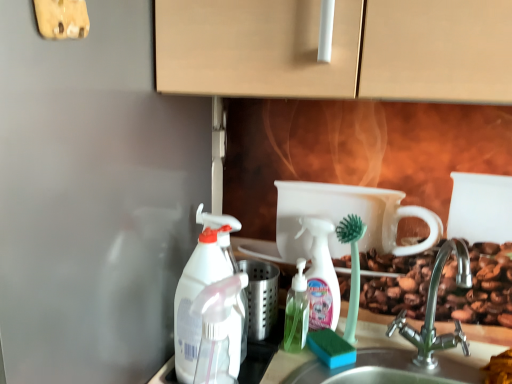
The height and width of the screenshot is (384, 512). What do you see at coordinates (321, 276) in the screenshot?
I see `translucent plastic spray bottle at center, the 1th cleaning product positioned from the right` at bounding box center [321, 276].

In order to face transparent plastic spray bottle at left, acting as the 3th cleaning product starting from the back, should I rotate leftwards or rightwards?

Rotate left and turn 4.954 degrees.

Identify the location of translucent plastic spray bottle at center, which appears as the third cleaning product when viewed from the front. The width and height of the screenshot is (512, 384). (321, 276).

Does satin nickel faucet at lower right turn towards green translucent soap dispenser at center?

No, satin nickel faucet at lower right is not oriented towards green translucent soap dispenser at center.

Between satin nickel faucet at lower right and green translucent soap dispenser at center, which one is positioned behind?

green translucent soap dispenser at center.

The image size is (512, 384). I want to click on bottle located below the satin nickel faucet at lower right (from the image's perspective), so click(x=297, y=312).

Which object is positioned more to the left, satin nickel faucet at lower right or green translucent soap dispenser at center?

From the viewer's perspective, green translucent soap dispenser at center appears more on the left side.

From the image's perspective, is green translucent soap dispenser at center positioned above or below white plastic spray bottle at left, marked as the third cleaning product in a right-to-left arrangement?

green translucent soap dispenser at center is below white plastic spray bottle at left, marked as the third cleaning product in a right-to-left arrangement.

Considering the relative positions of green translucent soap dispenser at center and white plastic spray bottle at left, the 2th cleaning product viewed from the back, in the image provided, is green translucent soap dispenser at center to the left of white plastic spray bottle at left, the 2th cleaning product viewed from the back, from the viewer's perspective?

In fact, green translucent soap dispenser at center is to the right of white plastic spray bottle at left, the 2th cleaning product viewed from the back.

Could you tell me if green translucent soap dispenser at center is facing white plastic spray bottle at left, marked as the third cleaning product in a right-to-left arrangement?

No, green translucent soap dispenser at center is not oriented towards white plastic spray bottle at left, marked as the third cleaning product in a right-to-left arrangement.

Is point (217, 348) closer to viewer compared to point (333, 298)?

Yes, it is in front of point (333, 298).

Which object is closer to the camera taking this photo, transparent plastic spray bottle at left, which appears as the second cleaning product when viewed from the right, or translucent plastic spray bottle at center, which appears as the third cleaning product when viewed from the front?

transparent plastic spray bottle at left, which appears as the second cleaning product when viewed from the right, is closer to the camera.

Which of these two, transparent plastic spray bottle at left, marked as the second cleaning product in a left-to-right arrangement, or translucent plastic spray bottle at center, which appears as the third cleaning product when viewed from the front, is smaller?

With smaller size is translucent plastic spray bottle at center, which appears as the third cleaning product when viewed from the front.

Is satin nickel faucet at lower right at the back of transparent plastic spray bottle at left, marked as the second cleaning product in a left-to-right arrangement?

A: No, transparent plastic spray bottle at left, marked as the second cleaning product in a left-to-right arrangement,'s orientation is not away from satin nickel faucet at lower right.

Could you measure the distance between transparent plastic spray bottle at left, acting as the 1th cleaning product starting from the front, and satin nickel faucet at lower right?

They are 15.44 inches apart.

Considering the sizes of objects transparent plastic spray bottle at left, acting as the 3th cleaning product starting from the back, and satin nickel faucet at lower right in the image provided, who is bigger, transparent plastic spray bottle at left, acting as the 3th cleaning product starting from the back, or satin nickel faucet at lower right?

Bigger between the two is satin nickel faucet at lower right.

Is the depth of transparent plastic spray bottle at left, which appears as the second cleaning product when viewed from the right, greater than that of satin nickel faucet at lower right?

No, transparent plastic spray bottle at left, which appears as the second cleaning product when viewed from the right, is in front of satin nickel faucet at lower right.

Are transparent plastic spray bottle at left, marked as the second cleaning product in a left-to-right arrangement, and green translucent soap dispenser at center located far from each other?

No, transparent plastic spray bottle at left, marked as the second cleaning product in a left-to-right arrangement, is not far from green translucent soap dispenser at center.

Considering the points (198, 296) and (293, 294), which point is in front, point (198, 296) or point (293, 294)?

The point (198, 296) is in front.

Considering the sizes of objects transparent plastic spray bottle at left, marked as the second cleaning product in a left-to-right arrangement, and green translucent soap dispenser at center in the image provided, who is smaller, transparent plastic spray bottle at left, marked as the second cleaning product in a left-to-right arrangement, or green translucent soap dispenser at center?

green translucent soap dispenser at center.

Does transparent plastic spray bottle at left, acting as the 3th cleaning product starting from the back, have a lesser width compared to green translucent soap dispenser at center?

In fact, transparent plastic spray bottle at left, acting as the 3th cleaning product starting from the back, might be wider than green translucent soap dispenser at center.

Is translucent plastic spray bottle at center, the 1th cleaning product positioned from the right, not inside satin nickel faucet at lower right?

Indeed, translucent plastic spray bottle at center, the 1th cleaning product positioned from the right, is completely outside satin nickel faucet at lower right.

Locate an element on the screen. This screenshot has width=512, height=384. the 1st cleaning product counting from the left side of the satin nickel faucet at lower right is located at coordinates pyautogui.click(x=321, y=276).

Is translucent plastic spray bottle at center, the 1th cleaning product positioned from the right, next to satin nickel faucet at lower right and touching it?

No.

Is translucent plastic spray bottle at center, which appears as the third cleaning product when viewed from the front, to the left or to the right of transparent plastic spray bottle at left, marked as the second cleaning product in a left-to-right arrangement, in the image?

Clearly, translucent plastic spray bottle at center, which appears as the third cleaning product when viewed from the front, is on the right of transparent plastic spray bottle at left, marked as the second cleaning product in a left-to-right arrangement, in the image.

Which of these two, translucent plastic spray bottle at center, acting as the 1th cleaning product starting from the back, or transparent plastic spray bottle at left, acting as the 1th cleaning product starting from the front, is smaller?

Smaller between the two is translucent plastic spray bottle at center, acting as the 1th cleaning product starting from the back.

Can you tell me how much translucent plastic spray bottle at center, acting as the 1th cleaning product starting from the back, and transparent plastic spray bottle at left, which appears as the second cleaning product when viewed from the right, differ in facing direction?

0.00672 degrees separate the facing orientations of translucent plastic spray bottle at center, acting as the 1th cleaning product starting from the back, and transparent plastic spray bottle at left, which appears as the second cleaning product when viewed from the right.

Can you confirm if translucent plastic spray bottle at center, positioned as the third cleaning product in left-to-right order, is shorter than transparent plastic spray bottle at left, acting as the 1th cleaning product starting from the front?

No, translucent plastic spray bottle at center, positioned as the third cleaning product in left-to-right order, is not shorter than transparent plastic spray bottle at left, acting as the 1th cleaning product starting from the front.

What are the coordinates of `bottle that is on the left side of satin nickel faucet at lower right` in the screenshot? It's located at (297, 312).

Identify the location of bottle below the white plastic spray bottle at left, the first cleaning product viewed from the left (from a real-world perspective). (297, 312).

Which object lies nearer to the anchor point white plastic spray bottle at left, the 2th cleaning product viewed from the back, translucent plastic spray bottle at center, acting as the 1th cleaning product starting from the back, or green translucent soap dispenser at center?

Among the two, green translucent soap dispenser at center is located nearer to white plastic spray bottle at left, the 2th cleaning product viewed from the back.

When comparing their distances from white plastic spray bottle at left, marked as the third cleaning product in a right-to-left arrangement, does green translucent soap dispenser at center or transparent plastic spray bottle at left, acting as the 1th cleaning product starting from the front, seem further?

green translucent soap dispenser at center is further to white plastic spray bottle at left, marked as the third cleaning product in a right-to-left arrangement.

From the picture: Based on their spatial positions, is green translucent soap dispenser at center or transparent plastic spray bottle at left, which appears as the second cleaning product when viewed from the right, further from satin nickel faucet at lower right?

Among the two, transparent plastic spray bottle at left, which appears as the second cleaning product when viewed from the right, is located further to satin nickel faucet at lower right.

Looking at this image, estimate the real-world distances between objects in this image. Which object is further from white plastic spray bottle at left, the 2th cleaning product viewed from the back, satin nickel faucet at lower right or green translucent soap dispenser at center?

satin nickel faucet at lower right is further to white plastic spray bottle at left, the 2th cleaning product viewed from the back.

Estimate the real-world distances between objects in this image. Which object is further from white plastic spray bottle at left, marked as the second cleaning product in a front-to-back arrangement, satin nickel faucet at lower right or transparent plastic spray bottle at left, which appears as the second cleaning product when viewed from the right?

satin nickel faucet at lower right is positioned further to the anchor white plastic spray bottle at left, marked as the second cleaning product in a front-to-back arrangement.

Considering their positions, is green translucent soap dispenser at center positioned closer to satin nickel faucet at lower right than white plastic spray bottle at left, the 2th cleaning product viewed from the back?

green translucent soap dispenser at center is positioned closer to the anchor satin nickel faucet at lower right.

Looking at the image, which one is located closer to green translucent soap dispenser at center, satin nickel faucet at lower right or translucent plastic spray bottle at center, which appears as the third cleaning product when viewed from the front?

translucent plastic spray bottle at center, which appears as the third cleaning product when viewed from the front, is positioned closer to the anchor green translucent soap dispenser at center.

Which object lies further to the anchor point transparent plastic spray bottle at left, acting as the 1th cleaning product starting from the front, white plastic spray bottle at left, the first cleaning product viewed from the left, or satin nickel faucet at lower right?

Among the two, satin nickel faucet at lower right is located further to transparent plastic spray bottle at left, acting as the 1th cleaning product starting from the front.

Where is `cleaning product located between green translucent soap dispenser at center and satin nickel faucet at lower right in the left-right direction`? This screenshot has height=384, width=512. cleaning product located between green translucent soap dispenser at center and satin nickel faucet at lower right in the left-right direction is located at coordinates (321, 276).

Find the location of a particular element. The height and width of the screenshot is (384, 512). cleaning product situated between transparent plastic spray bottle at left, which appears as the second cleaning product when viewed from the right, and satin nickel faucet at lower right from left to right is located at coordinates (321, 276).

Locate an element on the screen. Image resolution: width=512 pixels, height=384 pixels. bottle located between transparent plastic spray bottle at left, acting as the 1th cleaning product starting from the front, and satin nickel faucet at lower right in the left-right direction is located at coordinates (297, 312).

You are a GUI agent. You are given a task and a screenshot of the screen. Output one action in this format:
    pyautogui.click(x=<x>, y=<y>)
    Task: Click on the bottle situated between white plastic spray bottle at left, marked as the second cleaning product in a front-to-back arrangement, and translucent plastic spray bottle at center, the 1th cleaning product positioned from the right, from left to right
    Image resolution: width=512 pixels, height=384 pixels.
    Given the screenshot: What is the action you would take?
    pyautogui.click(x=297, y=312)